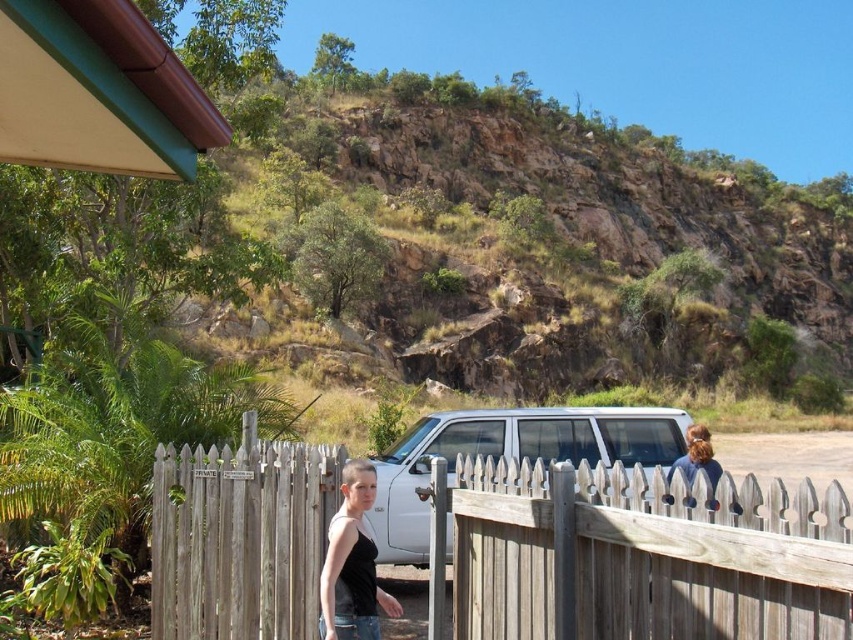
Consider the image. Measure the distance between point [695,548] and camera.

Point [695,548] is 18.98 feet away from camera.

The width and height of the screenshot is (853, 640). What do you see at coordinates (643, 556) in the screenshot? I see `wooden picket fence at center` at bounding box center [643, 556].

Which is behind, point (793, 598) or point (322, 570)?

The point (322, 570) is more distant.

Where is `wooden picket fence at center`? The height and width of the screenshot is (640, 853). wooden picket fence at center is located at coordinates (643, 556).

Is wooden picket fence at center to the right of white matte suv at center from the viewer's perspective?

No, wooden picket fence at center is not to the right of white matte suv at center.

The width and height of the screenshot is (853, 640). I want to click on wooden picket fence at center, so click(643, 556).

Is point (405, 529) positioned in front of point (323, 573)?

No, (405, 529) is further to viewer.

Who is positioned more to the left, white matte suv at center or black matte tank top at center?

From the viewer's perspective, black matte tank top at center appears more on the left side.

Who is more distant from viewer, [585,429] or [347,636]?

The point [585,429] is more distant.

The image size is (853, 640). What are the coordinates of `white matte suv at center` in the screenshot? It's located at click(508, 456).